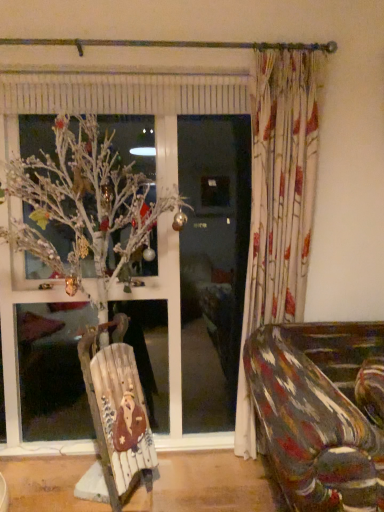
Where is `vacant space underneath wooden sled at center (from a real-world perspective)`? The image size is (384, 512). vacant space underneath wooden sled at center (from a real-world perspective) is located at coordinates (136, 500).